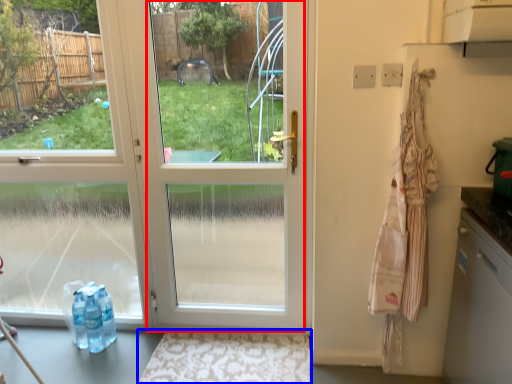
Question: Among these objects, which one is nearest to the camera, glass door (highlighted by a red box) or doormat (highlighted by a blue box)?

Choices:
 (A) glass door
 (B) doormat

Answer: (A)